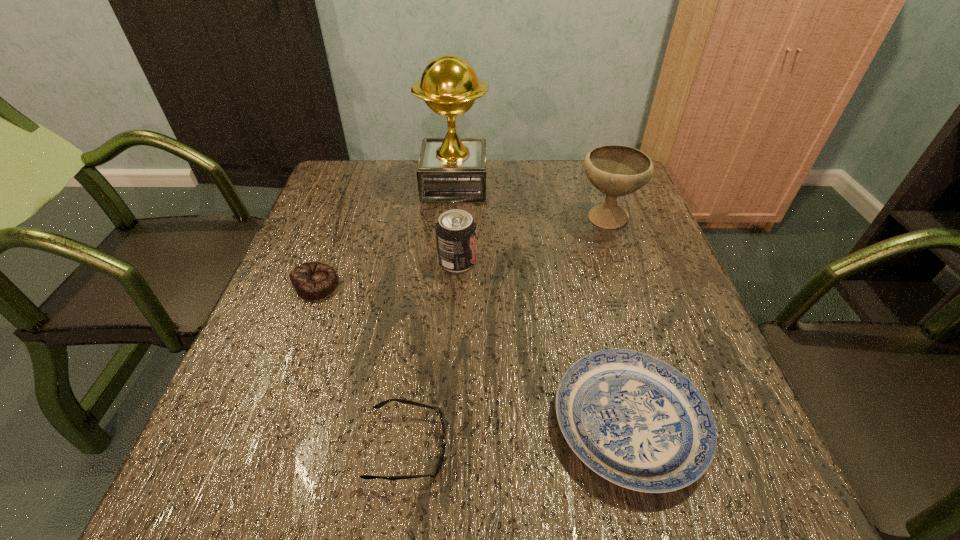
You are a GUI agent. You are given a task and a screenshot of the screen. Output one action in this format:
    pyautogui.click(x=<x>, y=<y>)
    Task: Click on the free region located on the lenses of the sunglasses
    This screenshot has width=960, height=540.
    Given the screenshot: What is the action you would take?
    pyautogui.click(x=479, y=447)

Image resolution: width=960 pixels, height=540 pixels. Find the location of `vacant space located on the right of the plate`. vacant space located on the right of the plate is located at coordinates (739, 423).

Image resolution: width=960 pixels, height=540 pixels. In order to click on award present at the far edge in this screenshot , I will do `click(451, 169)`.

Identify the location of chalice present at the far edge. The width and height of the screenshot is (960, 540). (616, 170).

Locate an element on the screen. The image size is (960, 540). sunglasses at the near edge is located at coordinates (433, 474).

Where is `plate that is at the near edge`? This screenshot has height=540, width=960. plate that is at the near edge is located at coordinates (635, 420).

Where is `object that is at the left edge`? object that is at the left edge is located at coordinates (312, 280).

Identify the location of chalice that is at the right edge. Image resolution: width=960 pixels, height=540 pixels. (616, 170).

This screenshot has width=960, height=540. I want to click on plate at the right edge, so click(635, 420).

Image resolution: width=960 pixels, height=540 pixels. What are the coordinates of `object that is at the far right corner` in the screenshot? It's located at (616, 170).